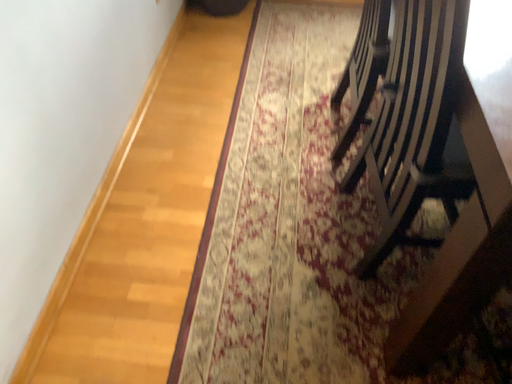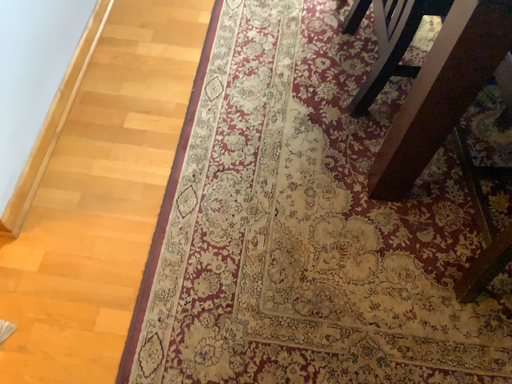
Question: Which way did the camera rotate in the video?

Choices:
 (A) rotated upward
 (B) rotated downward

Answer: (B)